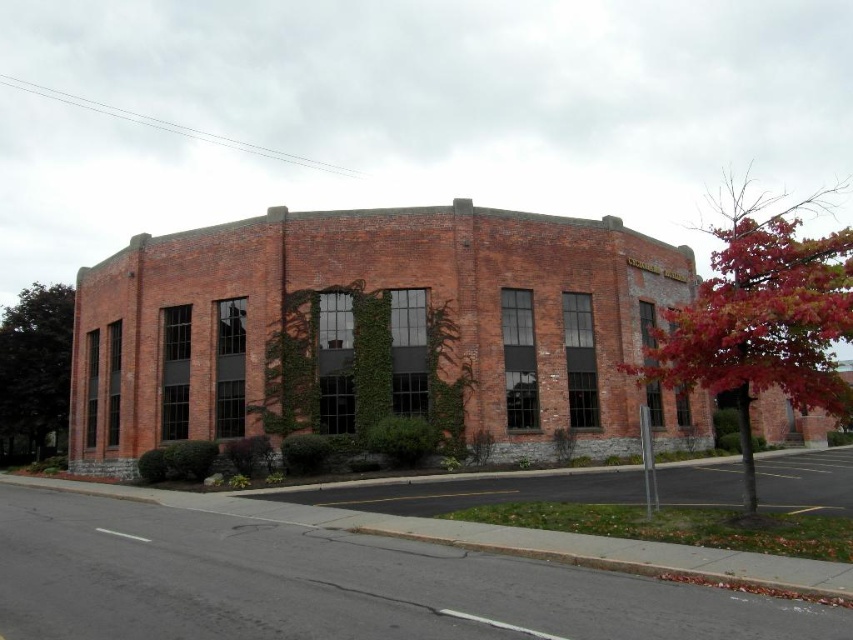
Question: Can you confirm if red leafy tree at right is smaller than green leafy tree at left?

Choices:
 (A) no
 (B) yes

Answer: (A)

Question: Is red leafy tree at right thinner than green leafy tree at left?

Choices:
 (A) yes
 (B) no

Answer: (B)

Question: Can you confirm if red leafy tree at right is smaller than green leafy tree at left?

Choices:
 (A) no
 (B) yes

Answer: (A)